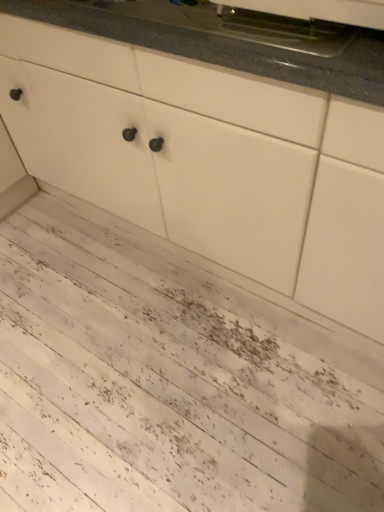
Question: Is metallic stainless steel oven at upper center not inside granite gray countertop at upper center?

Choices:
 (A) yes
 (B) no

Answer: (A)

Question: Is metallic stainless steel oven at upper center turned away from granite gray countertop at upper center?

Choices:
 (A) yes
 (B) no

Answer: (B)

Question: From the image's perspective, would you say metallic stainless steel oven at upper center is positioned over granite gray countertop at upper center?

Choices:
 (A) yes
 (B) no

Answer: (B)

Question: Does metallic stainless steel oven at upper center have a larger size compared to granite gray countertop at upper center?

Choices:
 (A) yes
 (B) no

Answer: (B)

Question: Is metallic stainless steel oven at upper center to the right of granite gray countertop at upper center from the viewer's perspective?

Choices:
 (A) yes
 (B) no

Answer: (A)

Question: Is white matte cabinet at center wider or thinner than granite gray countertop at upper center?

Choices:
 (A) wide
 (B) thin

Answer: (A)

Question: From a real-world perspective, is white matte cabinet at center physically located above or below granite gray countertop at upper center?

Choices:
 (A) above
 (B) below

Answer: (B)

Question: Based on their positions, is white matte cabinet at center located to the left or right of granite gray countertop at upper center?

Choices:
 (A) right
 (B) left

Answer: (A)

Question: From the image's perspective, is white matte cabinet at center located above or below granite gray countertop at upper center?

Choices:
 (A) below
 (B) above

Answer: (A)

Question: Considering the positions of granite gray countertop at upper center and white textured wood at lower left in the image, is granite gray countertop at upper center wider or thinner than white textured wood at lower left?

Choices:
 (A) thin
 (B) wide

Answer: (A)

Question: Is point (145, 26) positioned closer to the camera than point (223, 504)?

Choices:
 (A) closer
 (B) farther

Answer: (A)

Question: From the image's perspective, relative to white textured wood at lower left, is granite gray countertop at upper center above or below?

Choices:
 (A) above
 (B) below

Answer: (A)

Question: Is granite gray countertop at upper center in front of or behind white textured wood at lower left in the image?

Choices:
 (A) front
 (B) behind

Answer: (A)

Question: From the image's perspective, relative to metallic stainless steel oven at upper center, is white matte cabinet at center above or below?

Choices:
 (A) below
 (B) above

Answer: (A)

Question: In terms of height, does white matte cabinet at center look taller or shorter compared to metallic stainless steel oven at upper center?

Choices:
 (A) tall
 (B) short

Answer: (A)